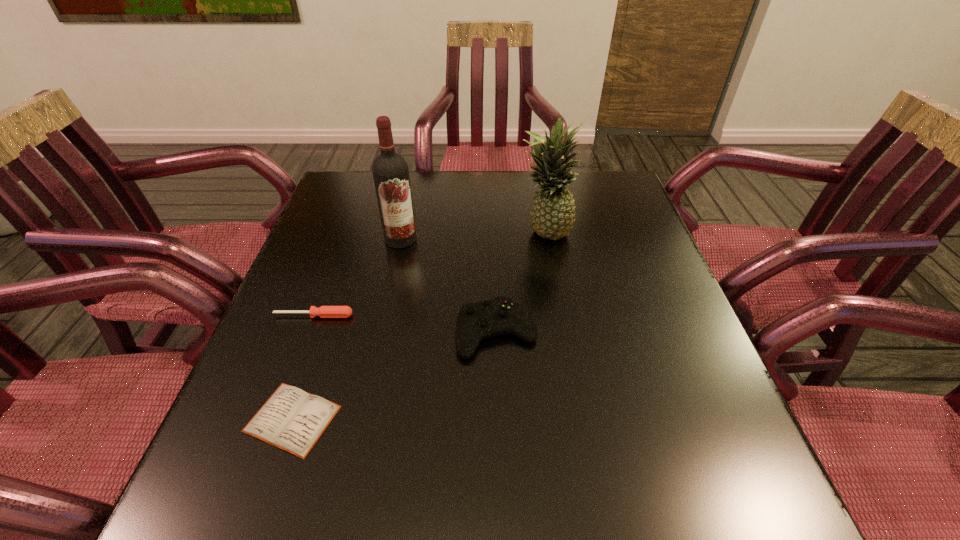
You are a GUI agent. You are given a task and a screenshot of the screen. Output one action in this format:
    pyautogui.click(x=<x>, y=<y>)
    Task: Click on the vacant space located on the back of the nearest object
    This screenshot has width=960, height=540.
    Given the screenshot: What is the action you would take?
    pyautogui.click(x=315, y=354)

I want to click on screwdriver situated at the left edge, so click(x=324, y=311).

Identify the location of diary at the left edge. (293, 420).

In the image, there is a desktop. At what (x,y) coordinates should I click in order to perform the action: click on vacant space at the far edge. Please return your answer as a coordinate pair (x, y). The image size is (960, 540). Looking at the image, I should click on (411, 175).

I want to click on vacant area at the near edge of the desktop, so click(658, 503).

Find the location of a particular element. The width and height of the screenshot is (960, 540). free space at the left edge is located at coordinates (274, 338).

The image size is (960, 540). In the image, there is a desktop. In order to click on vacant space at the right edge in this screenshot , I will do `click(689, 418)`.

Where is `vacant area at the far left corner`? Image resolution: width=960 pixels, height=540 pixels. vacant area at the far left corner is located at coordinates (335, 184).

Identify the location of free space at the far right corner. (602, 200).

Image resolution: width=960 pixels, height=540 pixels. I want to click on free space at the near right corner of the desktop, so click(688, 482).